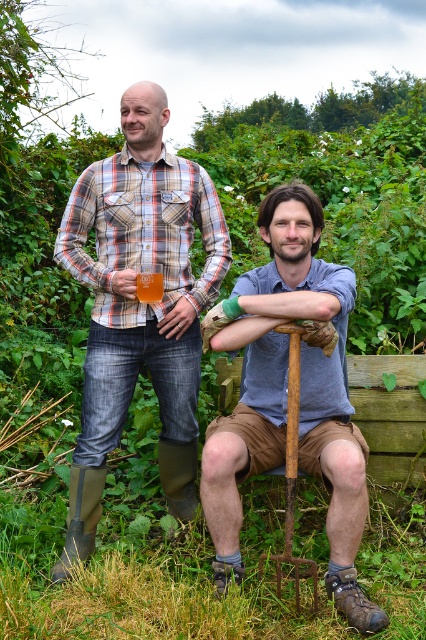
Consider the image. You are planning to take a photo of the plaid shirt at upper left and the rusty metal shovel at center. Which object should you focus on first if you want to capture both in the frame without moving the camera?

You should focus on the plaid shirt at upper left first because it is larger than the rusty metal shovel at center, so it will require more attention to ensure it fits properly in the frame.

You are standing in the garden scene described. You need to locate the plaid shirt at upper left. Based on its 2D coordinates, which are provided in the image, can you determine if it is positioned closer to the center or the edge of the image?

The plaid shirt at upper left is located at coordinates point (x=284, y=397). Since both coordinates are greater than 0.5, it is positioned closer to the center of the image rather than the edge.